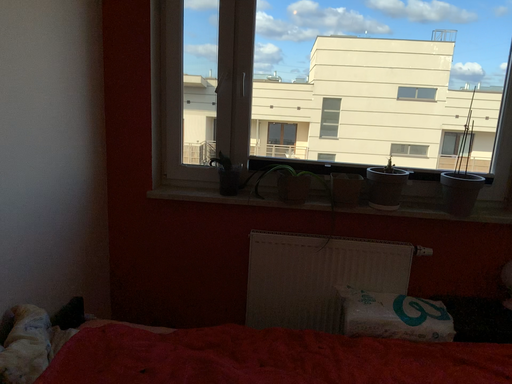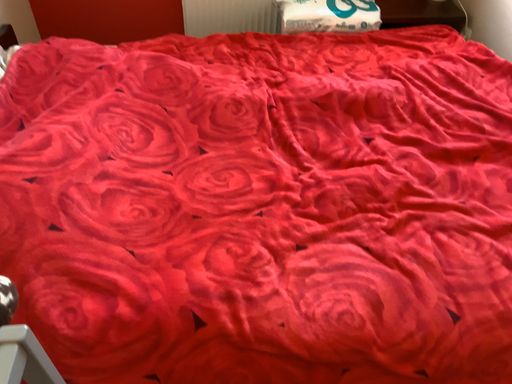
Question: How did the camera likely rotate when shooting the video?

Choices:
 (A) rotated upward
 (B) rotated downward

Answer: (B)